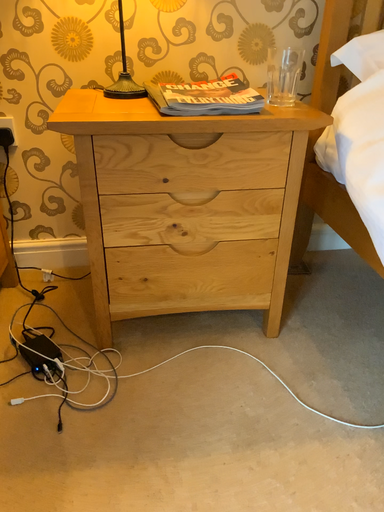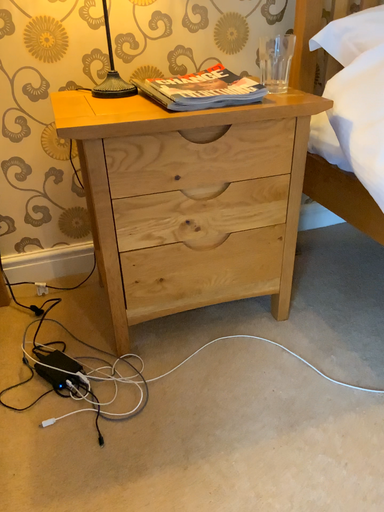
Question: Which way did the camera rotate in the video?

Choices:
 (A) rotated right
 (B) rotated left

Answer: (A)